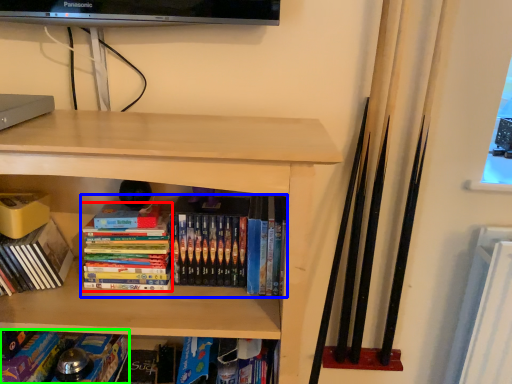
Question: Considering the real-world distances, which object is closest to book (highlighted by a red box)? book (highlighted by a blue box) or book (highlighted by a green box).

Choices:
 (A) book
 (B) book

Answer: (A)